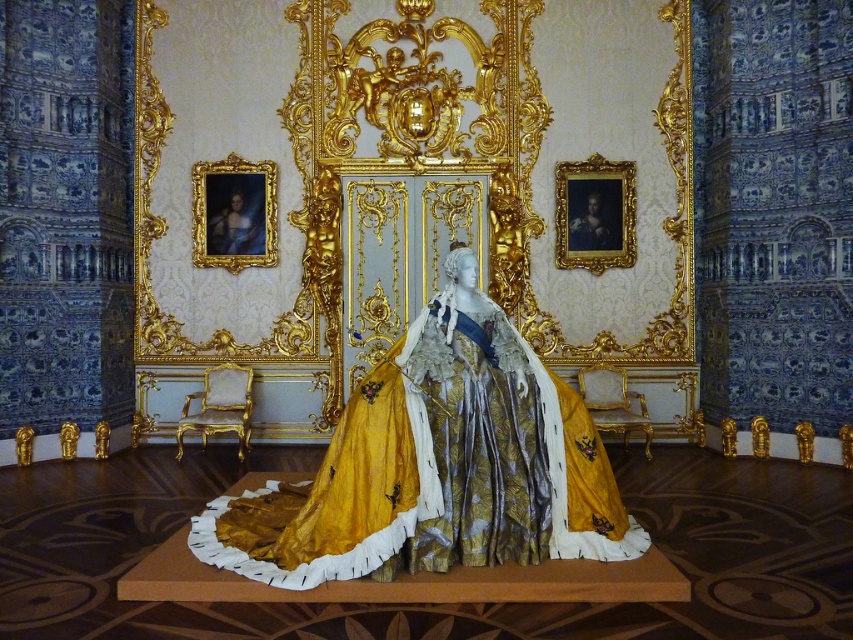
You are an interior designer planning to hang a new painting in the room. The gold ornate frame at upper left is represented by point (x=234, y=212). Where should you place the new painting to maintain symmetry with the existing decor?

To maintain symmetry with the existing decor, the new painting should be placed at the mirror image position of the gold ornate frame at upper left, which is point 0.666, 0.275.

You are a painter standing at the center of the room, holding a new painting that is 15 feet wide. You want to hang it between the gold ornate frame at upper left and the gold ornate frame at upper right. Can the painting fit horizontally between them?

The gold ornate frame at upper left and gold ornate frame at upper right are 14.94 feet apart. Since the painting is 15 feet wide, it cannot fit horizontally between them as the distance is slightly less than the painting width.